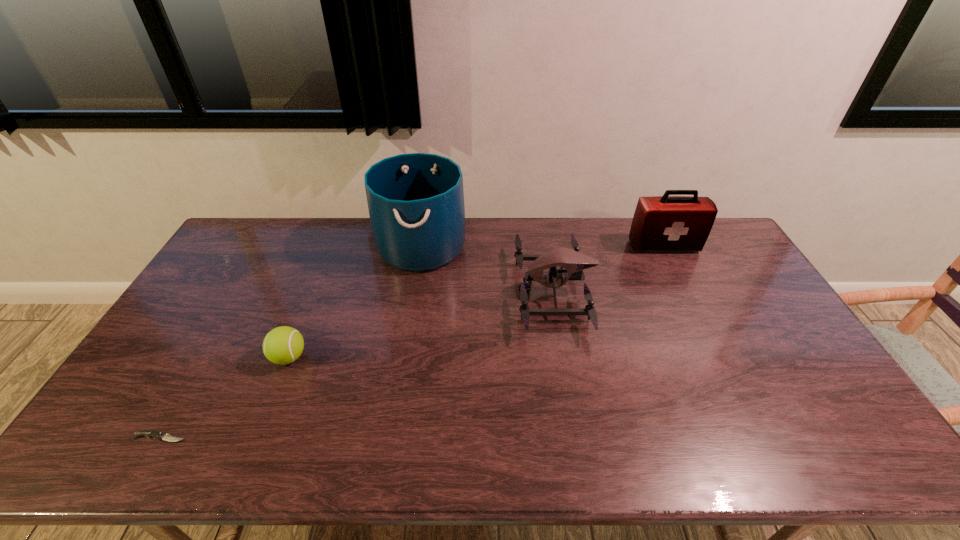
Where is `empty location between the fourth object from left to right and the rightmost object`? This screenshot has width=960, height=540. empty location between the fourth object from left to right and the rightmost object is located at coordinates (609, 269).

At what (x,y) coordinates should I click in order to perform the action: click on empty location between the nearest object and the tennis ball. Please return your answer as a coordinate pair (x, y). Looking at the image, I should click on (225, 397).

This screenshot has height=540, width=960. Identify the location of vacant area that lies between the second shortest object and the first aid kit. (476, 302).

This screenshot has height=540, width=960. What are the coordinates of `vacant area that lies between the second object from right to left and the tallest object` in the screenshot? It's located at (488, 269).

Image resolution: width=960 pixels, height=540 pixels. In order to click on free area in between the leftmost object and the second shortest object in this screenshot , I will do `click(225, 397)`.

Find the location of `vacant space that is in between the first aid kit and the tallest object`. vacant space that is in between the first aid kit and the tallest object is located at coordinates (542, 246).

The width and height of the screenshot is (960, 540). Find the location of `free point between the tennis ball and the nearest object`. free point between the tennis ball and the nearest object is located at coordinates (225, 397).

I want to click on blank region between the fourth object from left to right and the fourth object from right to left, so click(421, 325).

Identify which object is the third closest to the nearest object. Please provide its 2D coordinates. Your answer should be formatted as a tuple, i.e. [(x, y)], where the tuple contains the x and y coordinates of a point satisfying the conditions above.

[(573, 262)]

What are the coordinates of `object that is the fourth nearest to the third tallest object` in the screenshot? It's located at point(149,433).